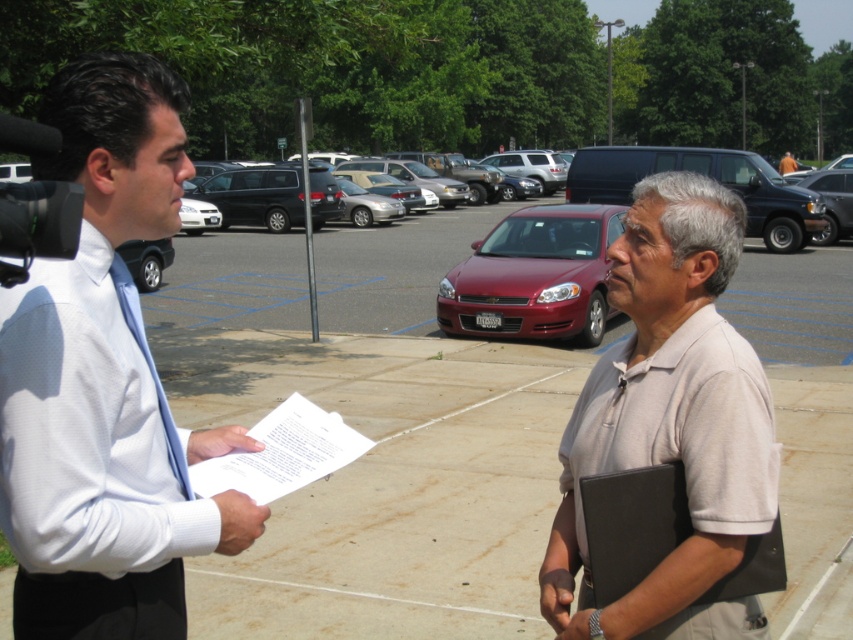
Is shiny red sedan at center above blue textured tie at left?

Yes, shiny red sedan at center is above blue textured tie at left.

At what (x,y) coordinates should I click in order to perform the action: click on shiny red sedan at center. Please return your answer as a coordinate pair (x, y). The height and width of the screenshot is (640, 853). Looking at the image, I should click on (534, 276).

Find the location of a particular element. shiny red sedan at center is located at coordinates (534, 276).

Can you confirm if blue textured tie at left is bigger than orange fabric shirt at center?

No.

Which is above, blue textured tie at left or orange fabric shirt at center?

orange fabric shirt at center is higher up.

Is point (115, 262) closer to camera compared to point (788, 157)?

Yes.

This screenshot has width=853, height=640. Find the location of `blue textured tie at left`. blue textured tie at left is located at coordinates (149, 365).

Which is in front, point (563, 253) or point (785, 172)?

Point (563, 253)

Does point (614, 220) lie behind point (784, 170)?

No.

This screenshot has width=853, height=640. Find the location of `shiny red sedan at center`. shiny red sedan at center is located at coordinates (534, 276).